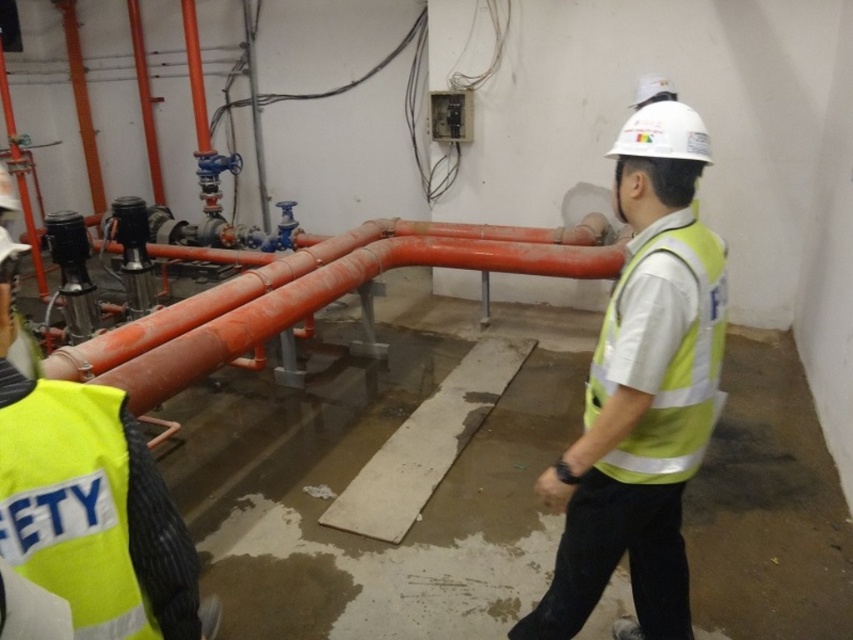
From the picture: In the industrial scene described, where exactly is the yellow reflective vest at center located in terms of coordinates?

The yellow reflective vest at center is located at point coordinates of (x=642, y=394).

Looking at this image, you are a maintenance worker in the utility room. You need to determine which object is larger between the orange matte pipes at center and the yellow reflective safety vest at center. Which one is bigger?

The orange matte pipes at center is bigger than the yellow reflective safety vest at center according to the description.

You are a maintenance worker in the industrial setting shown. You need to locate the orange matte pipes at center and the yellow reflective safety vest at center. According to the scene, which object is positioned to the left of the other?

The orange matte pipes at center are positioned to the left of the yellow reflective safety vest at center.